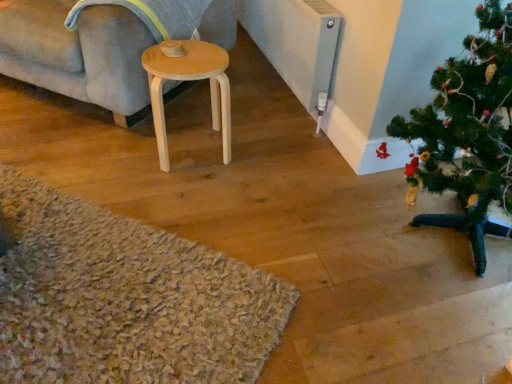
Image resolution: width=512 pixels, height=384 pixels. Find the location of `vacant area situated below light wood stool at center (from a real-world perspective)`. vacant area situated below light wood stool at center (from a real-world perspective) is located at coordinates (184, 141).